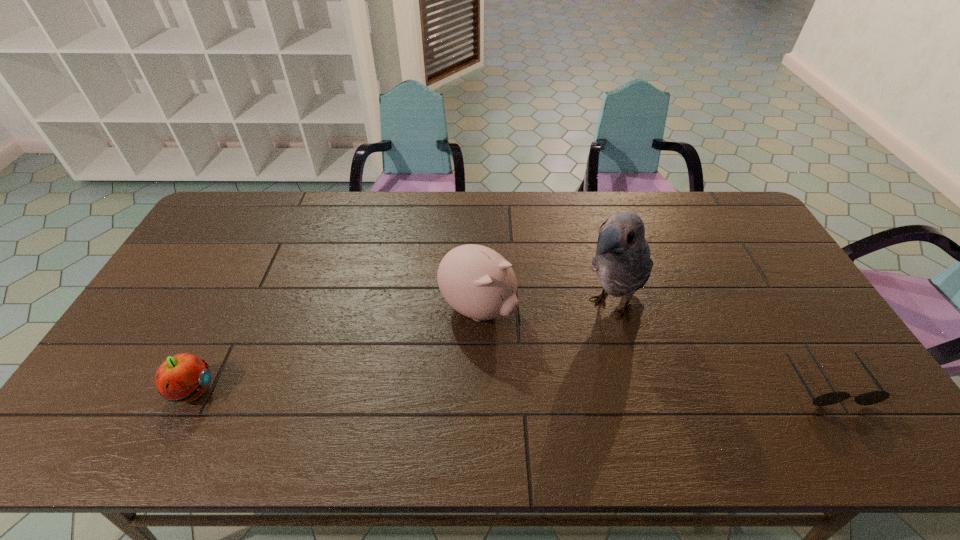
Locate an element on the screen. Image resolution: width=960 pixels, height=540 pixels. free space on the desktop that is between the second shortest object and the rightmost object and is positioned at the snout of the piggy bank is located at coordinates 588,386.

Locate an element on the screen. The height and width of the screenshot is (540, 960). free space on the desktop that is between the leftmost object and the shortest object and is positioned on the front-facing side of the tallest object is located at coordinates (531, 387).